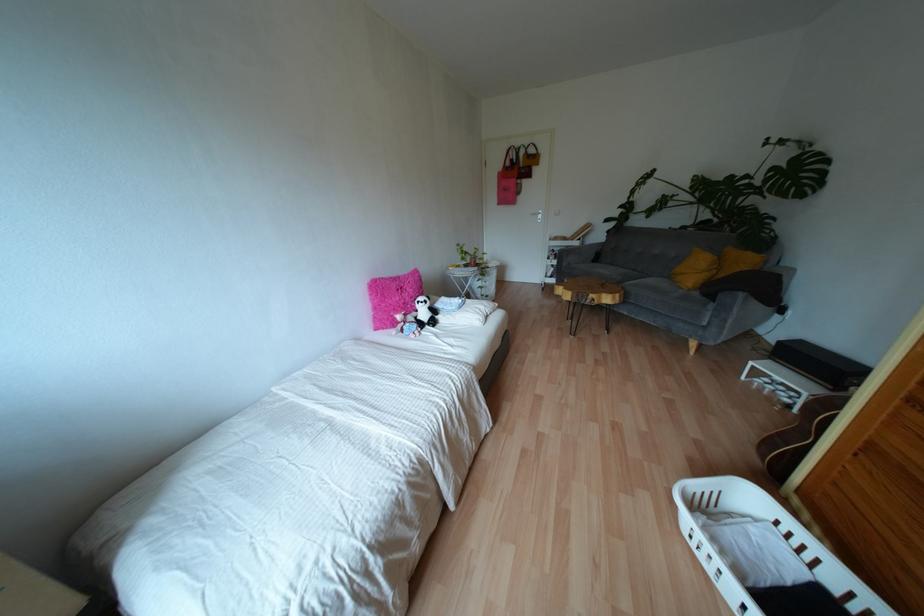
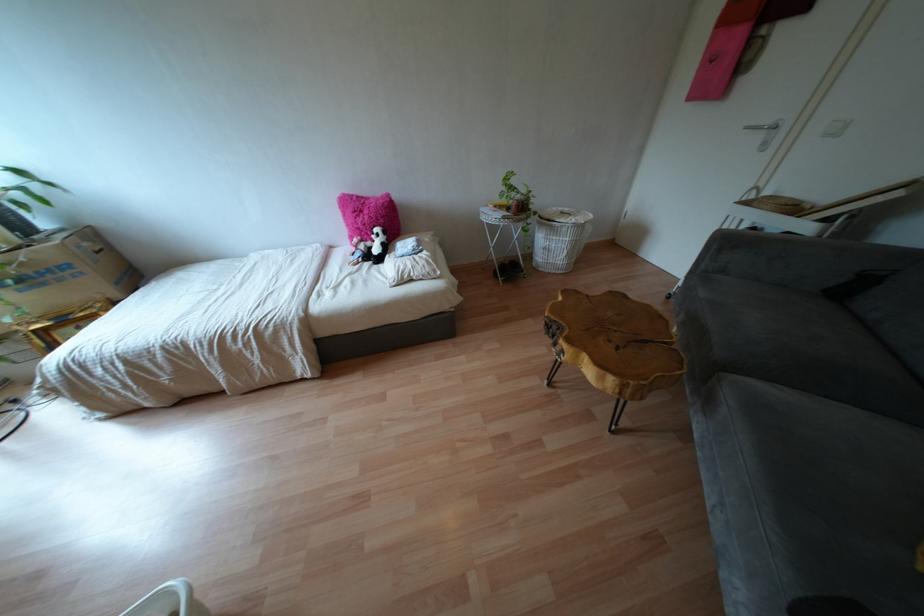
Find the pixel in the second image that matches [432,310] in the first image.

(385, 248)